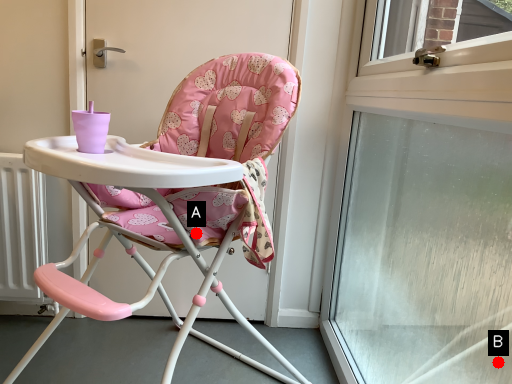
Question: Two points are circled on the image, labeled by A and B beside each circle. Which point is closer to the camera?

Choices:
 (A) A is closer
 (B) B is closer

Answer: (A)